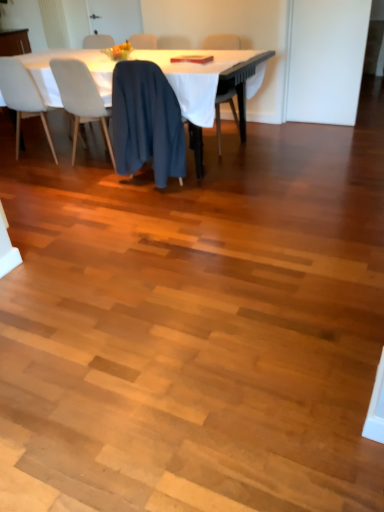
The image size is (384, 512). What do you see at coordinates (202, 77) in the screenshot? I see `white cloth-covered table at upper center` at bounding box center [202, 77].

What is the approximate width of dark blue fabric at center, placed as the third chair when sorted from left to right?

It is 11.68 inches.

The width and height of the screenshot is (384, 512). Describe the element at coordinates (146, 122) in the screenshot. I see `dark blue fabric at center, which is the second chair from right to left` at that location.

Describe the element at coordinates (219, 112) in the screenshot. I see `matte black chair at center, the first chair viewed from the right` at that location.

What are the coordinates of `white cloth-covered table at upper center` in the screenshot? It's located at (202, 77).

Considering the relative sizes of matte black chair at center, the first chair viewed from the right, and white cloth-covered table at upper center in the image provided, is matte black chair at center, the first chair viewed from the right, bigger than white cloth-covered table at upper center?

Incorrect, matte black chair at center, the first chair viewed from the right, is not larger than white cloth-covered table at upper center.

Can you confirm if matte black chair at center, the first chair viewed from the right, is thinner than white cloth-covered table at upper center?

Yes.

The image size is (384, 512). In the image, there is a white cloth-covered table at upper center. Find the location of `chair above it (from the image's perspective)`. chair above it (from the image's perspective) is located at coordinates (219, 112).

How much distance is there between matte black chair at center, the first chair viewed from the right, and white cloth-covered table at upper center?

A distance of 93.88 centimeters exists between matte black chair at center, the first chair viewed from the right, and white cloth-covered table at upper center.

Considering the sizes of objects blue fabric chair at center, the 2th chair when ordered from left to right, and white cloth-covered table at upper center in the image provided, who is thinner, blue fabric chair at center, the 2th chair when ordered from left to right, or white cloth-covered table at upper center?

With smaller width is blue fabric chair at center, the 2th chair when ordered from left to right.

From the picture: Is blue fabric chair at center, which is the third chair from right to left, oriented towards white cloth-covered table at upper center?

Yes, blue fabric chair at center, which is the third chair from right to left, is turned towards white cloth-covered table at upper center.

Are blue fabric chair at center, which is the third chair from right to left, and white cloth-covered table at upper center located far from each other?

Actually, blue fabric chair at center, which is the third chair from right to left, and white cloth-covered table at upper center are a little close together.

Does matte black chair at center, the fourth chair from the left, turn towards blue fabric chair at center, which is the third chair from right to left?

No, matte black chair at center, the fourth chair from the left, does not turn towards blue fabric chair at center, which is the third chair from right to left.

Can you confirm if matte black chair at center, the fourth chair from the left, is shorter than blue fabric chair at center, which is the third chair from right to left?

In fact, matte black chair at center, the fourth chair from the left, may be taller than blue fabric chair at center, which is the third chair from right to left.

Does point (214, 40) come closer to viewer compared to point (68, 66)?

No.

Can you confirm if matte black chair at center, the first chair viewed from the right, is smaller than blue fabric chair at center, the 2th chair when ordered from left to right?

Indeed, matte black chair at center, the first chair viewed from the right, has a smaller size compared to blue fabric chair at center, the 2th chair when ordered from left to right.

Identify the location of the 3rd chair positioned above the dark blue fabric at center, which is the second chair from right to left (from the image's perspective). (219, 112).

Between point (166, 122) and point (220, 103), which one is positioned in front?

The point (166, 122) is more forward.

From a real-world perspective, which object rests below the other?

dark blue fabric at center, placed as the third chair when sorted from left to right.

Based on the photo, which of these two, dark blue fabric at center, which is the second chair from right to left, or matte black chair at center, the first chair viewed from the right, is wider?

matte black chair at center, the first chair viewed from the right.

Between matte black chair at center, the fourth chair from the left, and dark blue fabric at center, placed as the third chair when sorted from left to right, which one appears on the left side from the viewer's perspective?

Positioned to the left is dark blue fabric at center, placed as the third chair when sorted from left to right.

Is matte black chair at center, the first chair viewed from the right, spatially inside dark blue fabric at center, which is the second chair from right to left, or outside of it?

matte black chair at center, the first chair viewed from the right, is not enclosed by dark blue fabric at center, which is the second chair from right to left.

Is matte black chair at center, the fourth chair from the left, not close to dark blue fabric at center, which is the second chair from right to left?

Yes, matte black chair at center, the fourth chair from the left, and dark blue fabric at center, which is the second chair from right to left, are located far from each other.

From a real-world perspective, is matte black chair at center, the fourth chair from the left, beneath dark blue fabric at center, which is the second chair from right to left?

Actually, matte black chair at center, the fourth chair from the left, is physically above dark blue fabric at center, which is the second chair from right to left, in the real world.

Between blue fabric chair at center, the 2th chair when ordered from left to right, and white fabric chair at left, marked as the fourth chair in a right-to-left arrangement, which one has larger size?

white fabric chair at left, marked as the fourth chair in a right-to-left arrangement.

This screenshot has width=384, height=512. Identify the location of the 1st chair behind the blue fabric chair at center, which is the third chair from right to left, starting your count from the anchor. pos(22,96).

Looking at this image, is blue fabric chair at center, the 2th chair when ordered from left to right, completely or partially outside of white fabric chair at left, the first chair viewed from the left?

Yes.

Is blue fabric chair at center, which is the third chair from right to left, beside white fabric chair at left, the first chair viewed from the left?

No, blue fabric chair at center, which is the third chair from right to left, is not making contact with white fabric chair at left, the first chair viewed from the left.

Is white fabric chair at left, the first chair viewed from the left, taller or shorter than matte black chair at center, the fourth chair from the left?

white fabric chair at left, the first chair viewed from the left, is taller than matte black chair at center, the fourth chair from the left.

Could you tell me if white fabric chair at left, marked as the fourth chair in a right-to-left arrangement, is turned towards matte black chair at center, the fourth chair from the left?

No, white fabric chair at left, marked as the fourth chair in a right-to-left arrangement, does not turn towards matte black chair at center, the fourth chair from the left.

Considering the positions of point (35, 103) and point (218, 144), is point (35, 103) closer or farther from the camera than point (218, 144)?

Point (35, 103).

This screenshot has width=384, height=512. I want to click on table below the matte black chair at center, the first chair viewed from the right (from a real-world perspective), so click(202, 77).

At what (x,y) coordinates should I click in order to perform the action: click on the 2nd chair positioned below the white cloth-covered table at upper center (from the image's perspective). Please return your answer as a coordinate pair (x, y). Image resolution: width=384 pixels, height=512 pixels. Looking at the image, I should click on (80, 98).

When comparing their distances from white cloth-covered table at upper center, does matte black chair at center, the fourth chair from the left, or blue fabric chair at center, which is the third chair from right to left, seem closer?

Based on the image, blue fabric chair at center, which is the third chair from right to left, appears to be nearer to white cloth-covered table at upper center.

Which object lies nearer to the anchor point white cloth-covered table at upper center, dark blue fabric at center, which is the second chair from right to left, or matte black chair at center, the fourth chair from the left?

Among the two, dark blue fabric at center, which is the second chair from right to left, is located nearer to white cloth-covered table at upper center.

Which object lies nearer to the anchor point white cloth-covered table at upper center, white fabric chair at left, the first chair viewed from the left, or matte black chair at center, the fourth chair from the left?

white fabric chair at left, the first chair viewed from the left, is closer to white cloth-covered table at upper center.

Consider the image. When comparing their distances from dark blue fabric at center, placed as the third chair when sorted from left to right, does matte black chair at center, the fourth chair from the left, or white fabric chair at left, marked as the fourth chair in a right-to-left arrangement, seem further?

matte black chair at center, the fourth chair from the left, lies further to dark blue fabric at center, placed as the third chair when sorted from left to right, than the other object.

Estimate the real-world distances between objects in this image. Which object is closer to white cloth-covered table at upper center, white fabric chair at left, the first chair viewed from the left, or blue fabric chair at center, which is the third chair from right to left?

Based on the image, blue fabric chair at center, which is the third chair from right to left, appears to be nearer to white cloth-covered table at upper center.

Considering their positions, is matte black chair at center, the fourth chair from the left, positioned further to blue fabric chair at center, the 2th chair when ordered from left to right, than white fabric chair at left, the first chair viewed from the left?

matte black chair at center, the fourth chair from the left, lies further to blue fabric chair at center, the 2th chair when ordered from left to right, than the other object.

Looking at the image, which one is located closer to blue fabric chair at center, the 2th chair when ordered from left to right, white fabric chair at left, marked as the fourth chair in a right-to-left arrangement, or matte black chair at center, the fourth chair from the left?

The object closer to blue fabric chair at center, the 2th chair when ordered from left to right, is white fabric chair at left, marked as the fourth chair in a right-to-left arrangement.

Which object lies further to the anchor point matte black chair at center, the fourth chair from the left, white cloth-covered table at upper center or blue fabric chair at center, which is the third chair from right to left?

The object further to matte black chair at center, the fourth chair from the left, is blue fabric chair at center, which is the third chair from right to left.

This screenshot has width=384, height=512. Identify the location of chair between blue fabric chair at center, the 2th chair when ordered from left to right, and matte black chair at center, the first chair viewed from the right. (146, 122).

The image size is (384, 512). In order to click on table between white fabric chair at left, the first chair viewed from the left, and dark blue fabric at center, placed as the third chair when sorted from left to right, in the horizontal direction in this screenshot , I will do `click(202, 77)`.

You are a GUI agent. You are given a task and a screenshot of the screen. Output one action in this format:
    pyautogui.click(x=<x>, y=<y>)
    Task: Click on the table between blue fabric chair at center, which is the third chair from right to left, and matte black chair at center, the fourth chair from the left, in the horizontal direction
    Image resolution: width=384 pixels, height=512 pixels.
    Given the screenshot: What is the action you would take?
    pyautogui.click(x=202, y=77)

Image resolution: width=384 pixels, height=512 pixels. What are the coordinates of `table situated between white fabric chair at left, the first chair viewed from the left, and matte black chair at center, the first chair viewed from the right, from left to right` in the screenshot? It's located at (202, 77).